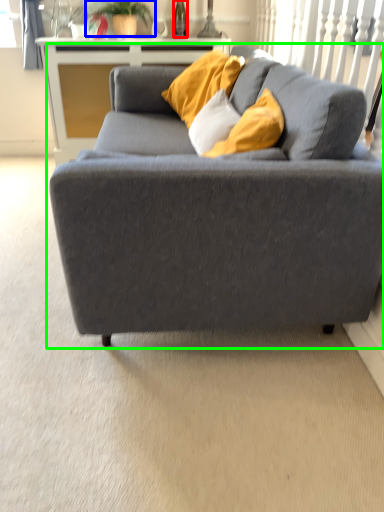
Question: Which object is positioned farthest from wine bottle (highlighted by a red box)? Select from plant (highlighted by a blue box) and studio couch (highlighted by a green box).

Choices:
 (A) plant
 (B) studio couch

Answer: (B)